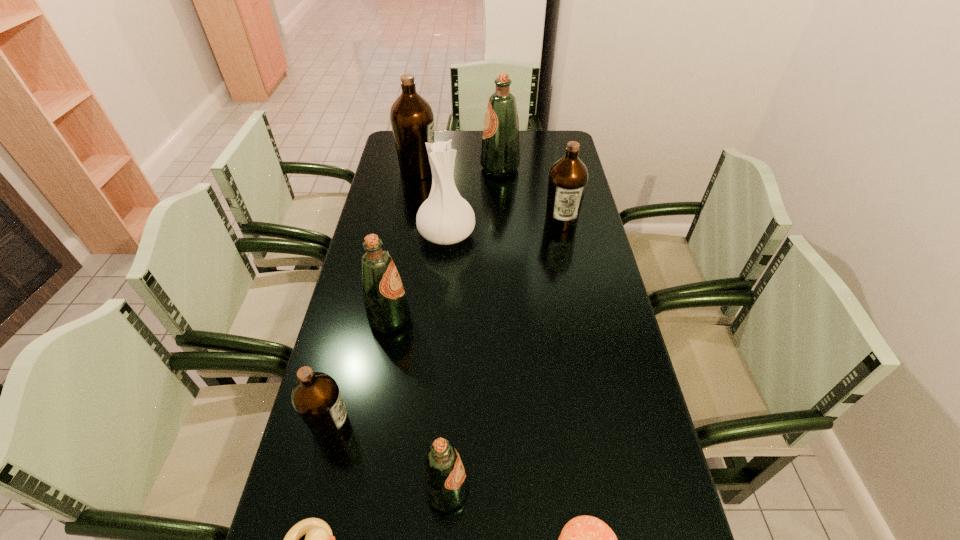
Find the location of `unoccupied area between the biggest brown olive oil and the second farthest brown olive oil`. unoccupied area between the biggest brown olive oil and the second farthest brown olive oil is located at coordinates (490, 196).

Find the location of a particular element. The image size is (960, 540). free space between the smallest brown olive oil and the nearest green olive oil is located at coordinates (389, 458).

Where is `the second closest object relative to the second nearest brown olive oil`? This screenshot has width=960, height=540. the second closest object relative to the second nearest brown olive oil is located at coordinates (445, 218).

Identify which object is the seventh nearest to the shortest object. Please provide its 2D coordinates. Your answer should be formatted as a tuple, i.e. [(x, y)], where the tuple contains the x and y coordinates of a point satisfying the conditions above.

[(411, 116)]

Select which olive oil appears as the closest to the white vase. Please provide its 2D coordinates. Your answer should be formatted as a tuple, i.e. [(x, y)], where the tuple contains the x and y coordinates of a point satisfying the conditions above.

[(386, 306)]

Identify the location of olive oil that is the second nearest to the smallest brown olive oil. (386, 306).

The width and height of the screenshot is (960, 540). What are the coordinates of `the closest green olive oil relative to the rightmost green olive oil` in the screenshot? It's located at (386, 306).

Choose which green olive oil is the third nearest neighbor to the second nearest olive oil. Please provide its 2D coordinates. Your answer should be formatted as a tuple, i.e. [(x, y)], where the tuple contains the x and y coordinates of a point satisfying the conditions above.

[(500, 153)]

Locate which brown olive oil is the third closest to the rightmost green olive oil. Please provide its 2D coordinates. Your answer should be formatted as a tuple, i.e. [(x, y)], where the tuple contains the x and y coordinates of a point satisfying the conditions above.

[(316, 397)]

Choose which brown olive oil is the nearest neighbor to the shortest object. Please provide its 2D coordinates. Your answer should be formatted as a tuple, i.e. [(x, y)], where the tuple contains the x and y coordinates of a point satisfying the conditions above.

[(316, 397)]